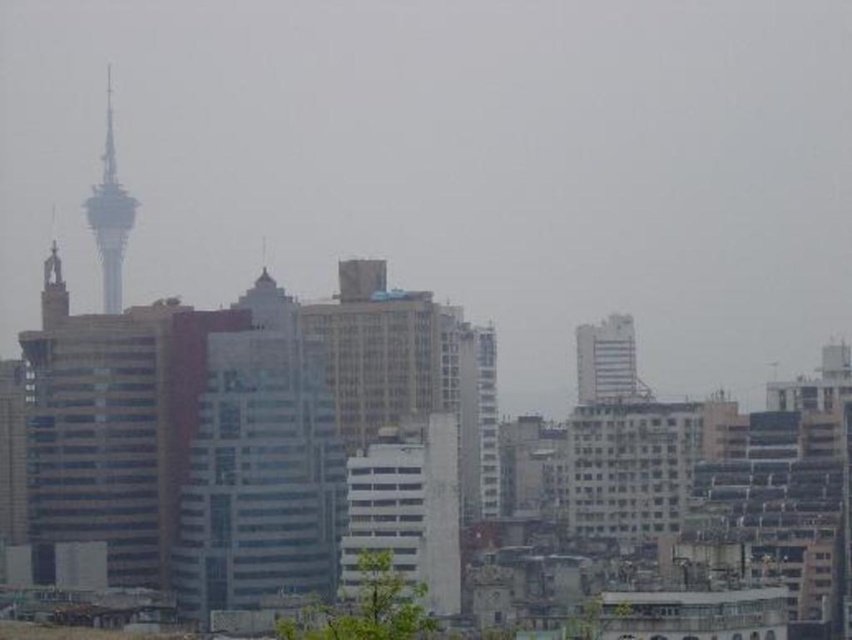
Question: Can you confirm if metallic silver tower at left is bigger than white glossy building at upper center?

Choices:
 (A) no
 (B) yes

Answer: (B)

Question: In this image, where is matte glass building at center located relative to metallic silver tower at left?

Choices:
 (A) above
 (B) below

Answer: (B)

Question: Considering the real-world distances, which object is farthest from the matte glass building at center?

Choices:
 (A) white glossy building at upper center
 (B) metallic silver tower at left

Answer: (A)

Question: Does matte glass building at center appear over white glossy building at upper center?

Choices:
 (A) no
 (B) yes

Answer: (A)

Question: Which point is farther from the camera taking this photo?

Choices:
 (A) (283, 481)
 (B) (630, 380)
 (C) (101, 209)

Answer: (C)

Question: Estimate the real-world distances between objects in this image. Which object is farther from the matte glass building at center?

Choices:
 (A) white glossy building at upper center
 (B) metallic silver tower at left

Answer: (A)